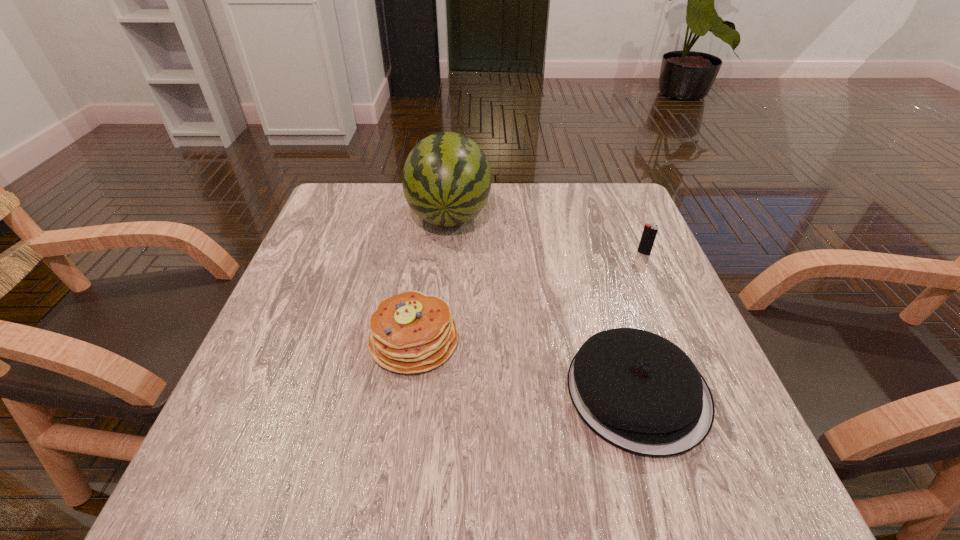
Where is `the farthest object`? the farthest object is located at coordinates (446, 180).

What are the coordinates of `the tallest object` in the screenshot? It's located at (446, 180).

Locate an element on the screen. This screenshot has height=540, width=960. the second farthest object is located at coordinates (650, 231).

This screenshot has height=540, width=960. I want to click on the left pancake, so click(x=410, y=332).

You are a GUI agent. You are given a task and a screenshot of the screen. Output one action in this format:
    pyautogui.click(x=<x>, y=<y>)
    Task: Click on the right pancake
    
    Given the screenshot: What is the action you would take?
    (x=638, y=391)

The height and width of the screenshot is (540, 960). I want to click on the shortest object, so click(x=638, y=391).

At what (x,y) coordinates should I click in order to perform the action: click on free space located at the stem end of the tallest object. Please return your answer as a coordinate pair (x, y). This screenshot has width=960, height=540. Looking at the image, I should click on (444, 273).

Where is `free space located 0.200m on the left of the second farthest object`? The image size is (960, 540). free space located 0.200m on the left of the second farthest object is located at coordinates (552, 253).

Locate an element on the screen. Image resolution: width=960 pixels, height=540 pixels. vacant space located 0.110m on the left of the taller pancake is located at coordinates (311, 340).

I want to click on vacant space located 0.340m on the back of the right pancake, so click(588, 231).